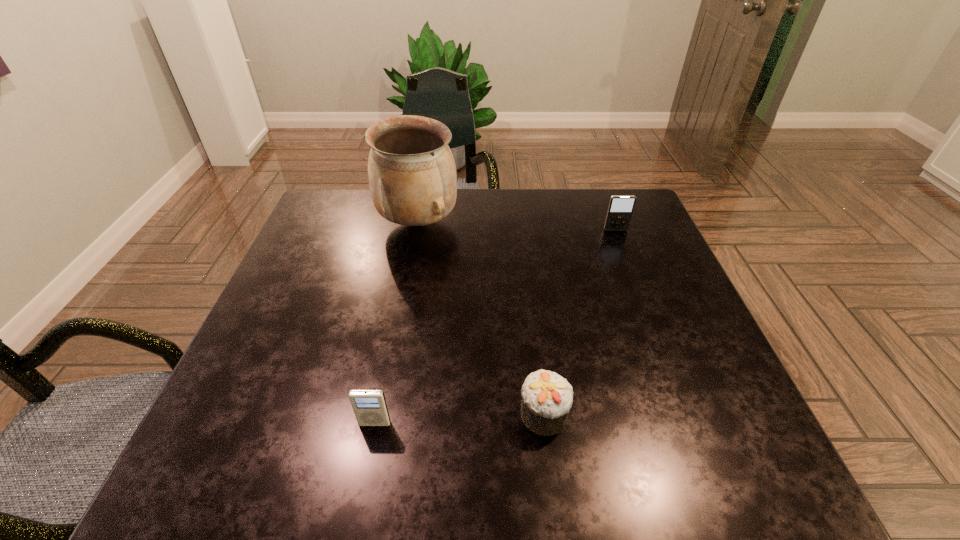
Where is `iPod at the far edge`? This screenshot has width=960, height=540. iPod at the far edge is located at coordinates (620, 209).

The image size is (960, 540). In order to click on object positioned at the near edge in this screenshot , I will do `click(546, 397)`.

This screenshot has height=540, width=960. What are the coordinates of `object that is at the right edge` in the screenshot? It's located at (620, 209).

Find the location of a particular element. The image size is (960, 540). object that is at the far right corner is located at coordinates (620, 209).

Where is `free space at the far edge of the desktop`? free space at the far edge of the desktop is located at coordinates (556, 208).

The height and width of the screenshot is (540, 960). In the image, there is a desktop. What are the coordinates of `vacant space at the near edge` in the screenshot? It's located at (400, 481).

The image size is (960, 540). I want to click on free point at the left edge, so click(x=313, y=361).

Where is `vacant region at the right edge`? Image resolution: width=960 pixels, height=540 pixels. vacant region at the right edge is located at coordinates (677, 377).

This screenshot has width=960, height=540. In order to click on free region at the far left corner in this screenshot , I will do `click(330, 207)`.

Locate an element on the screen. free space between the cupcake and the right iPod is located at coordinates (580, 322).